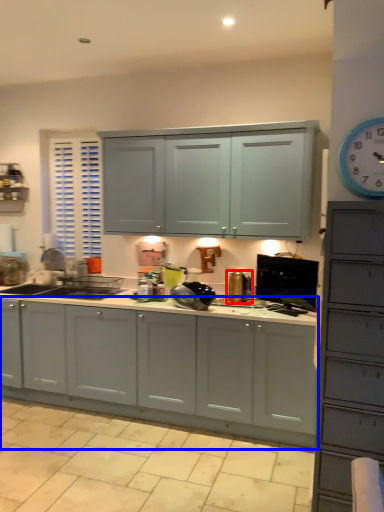
Question: Which object is further to the camera taking this photo, appliance (highlighted by a red box) or cabinetry (highlighted by a blue box)?

Choices:
 (A) appliance
 (B) cabinetry

Answer: (A)